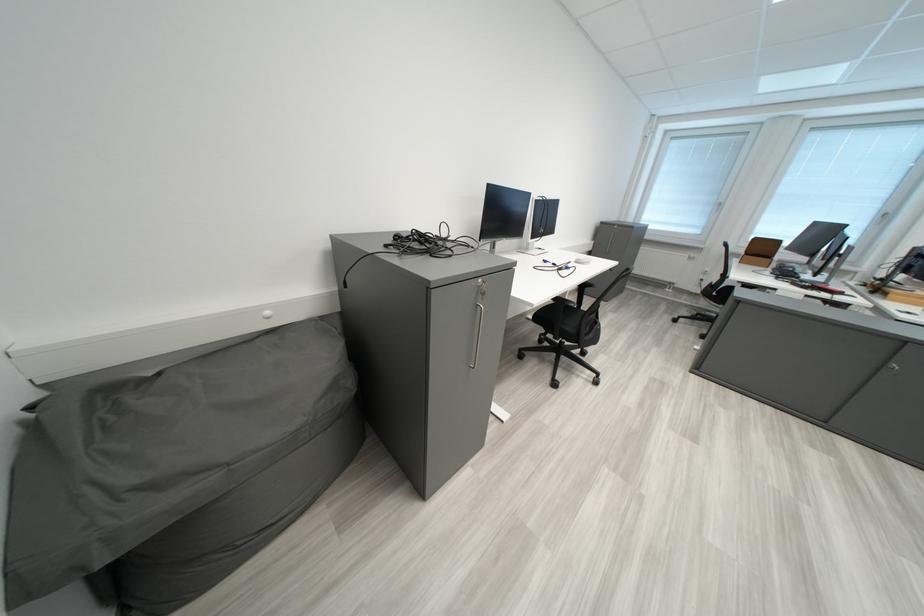
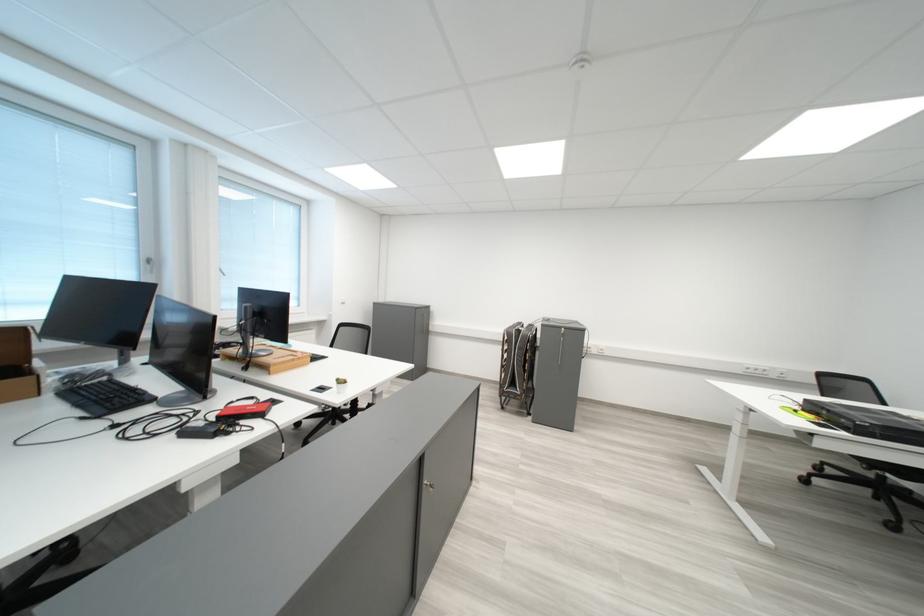
The point at (807, 286) is marked in the first image. Where is the corresponding point in the second image?

(200, 436)